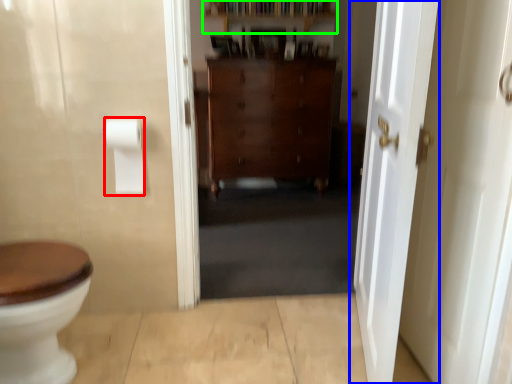
Question: Considering the real-world distances, which object is closest to to paper towel (highlighted by a red box)? door (highlighted by a blue box) or shelf (highlighted by a green box).

Choices:
 (A) door
 (B) shelf

Answer: (A)